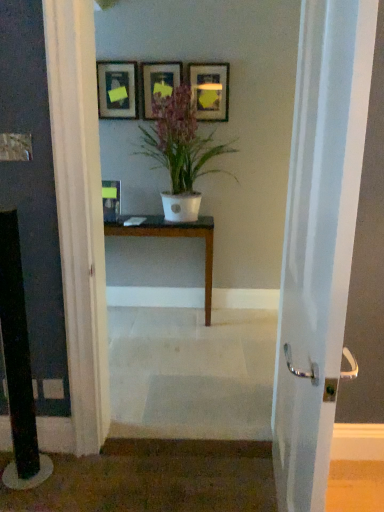
Question: Can you see dark brown wood table at center touching matte black picture frame at center, which is counted as the fourth picture frame, starting from the right?

Choices:
 (A) yes
 (B) no

Answer: (B)

Question: Can you confirm if dark brown wood table at center is positioned to the right of matte black picture frame at center, which is counted as the fourth picture frame, starting from the right?

Choices:
 (A) yes
 (B) no

Answer: (A)

Question: Is dark brown wood table at center not within matte black picture frame at center, which ranks as the first picture frame in left-to-right order?

Choices:
 (A) no
 (B) yes

Answer: (B)

Question: From the image's perspective, does dark brown wood table at center appear lower than matte black picture frame at center, which ranks as the first picture frame in left-to-right order?

Choices:
 (A) no
 (B) yes

Answer: (B)

Question: Is dark brown wood table at center looking in the opposite direction of matte black picture frame at center, which is counted as the fourth picture frame, starting from the right?

Choices:
 (A) yes
 (B) no

Answer: (B)

Question: Considering the positions of white glossy door handle at center and white matte pot at center in the image, is white glossy door handle at center taller or shorter than white matte pot at center?

Choices:
 (A) tall
 (B) short

Answer: (A)

Question: Do you think white glossy door handle at center is within white matte pot at center, or outside of it?

Choices:
 (A) inside
 (B) outside

Answer: (B)

Question: Considering the positions of white glossy door handle at center and white matte pot at center in the image, is white glossy door handle at center wider or thinner than white matte pot at center?

Choices:
 (A) thin
 (B) wide

Answer: (A)

Question: From a real-world perspective, is white glossy door handle at center above or below white matte pot at center?

Choices:
 (A) above
 (B) below

Answer: (B)

Question: Considering the positions of point (175, 121) and point (210, 106), is point (175, 121) closer or farther from the camera than point (210, 106)?

Choices:
 (A) farther
 (B) closer

Answer: (B)

Question: From a real-world perspective, is white matte pot at center physically located above or below matte black picture frame at upper center, the first picture frame when ordered from right to left?

Choices:
 (A) below
 (B) above

Answer: (A)

Question: In the image, is white matte pot at center positioned in front of or behind matte black picture frame at upper center, the 4th picture frame viewed from the left?

Choices:
 (A) front
 (B) behind

Answer: (A)

Question: Is white matte pot at center wider or thinner than matte black picture frame at upper center, the first picture frame when ordered from right to left?

Choices:
 (A) wide
 (B) thin

Answer: (A)

Question: Looking at the image, does matte black picture frame at upper center, the first picture frame when ordered from right to left, seem bigger or smaller compared to white matte pot at center?

Choices:
 (A) big
 (B) small

Answer: (B)

Question: From a real-world perspective, is matte black picture frame at upper center, the 4th picture frame viewed from the left, positioned above or below white matte pot at center?

Choices:
 (A) below
 (B) above

Answer: (B)